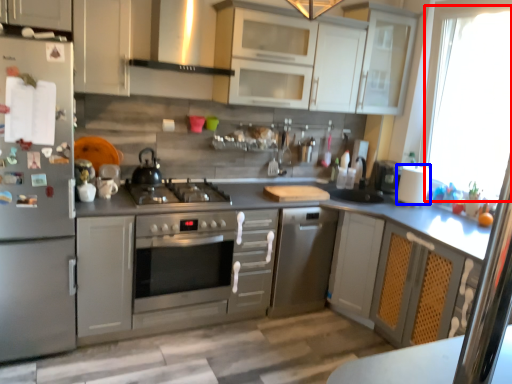
Question: Which point is closer to the camera, window screen (highlighted by a red box) or paper towel (highlighted by a blue box)?

Choices:
 (A) window screen
 (B) paper towel

Answer: (A)